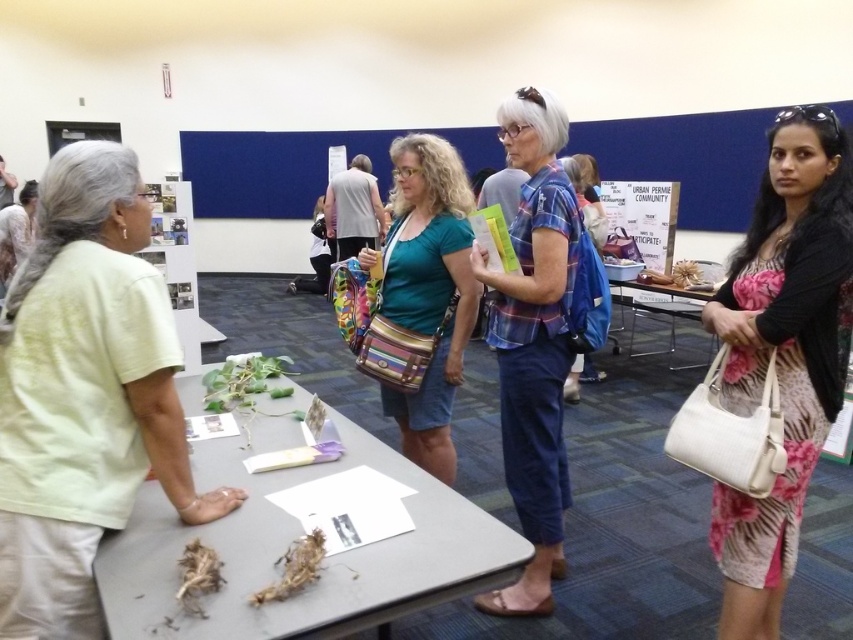
Consider the image. Who is positioned more to the right, light yellow cotton shirt at lower left or metallic silver table at center?

metallic silver table at center

How far apart are light yellow cotton shirt at lower left and metallic silver table at center?

light yellow cotton shirt at lower left is 4.29 meters from metallic silver table at center.

Which is behind, point (26, 294) or point (654, 353)?

The point (654, 353) is more distant.

This screenshot has height=640, width=853. Identify the location of light yellow cotton shirt at lower left. (84, 394).

Is light yellow cotton shirt at lower left positioned in front of plaid fabric shirt at center?

That is True.

Which is behind, point (117, 524) or point (520, 600)?

The point (520, 600) is more distant.

At what (x,y) coordinates should I click in order to perform the action: click on light yellow cotton shirt at lower left. Please return your answer as a coordinate pair (x, y). The height and width of the screenshot is (640, 853). Looking at the image, I should click on (84, 394).

Which is in front, point (248, 605) or point (561, 372)?

Positioned in front is point (248, 605).

Is point (244, 456) positioned before point (538, 225)?

Yes.

Is point (138, 554) positioned after point (555, 477)?

No, it is in front of (555, 477).

The height and width of the screenshot is (640, 853). I want to click on gray matte table at center, so click(294, 538).